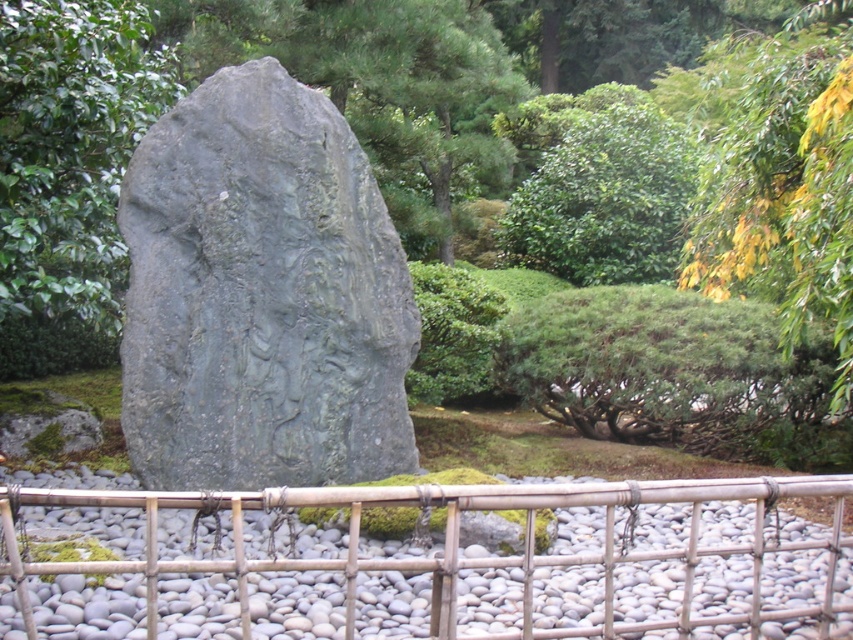
Is gray stone carving at center closer to the viewer compared to green leafy bush at upper center?

Yes, it is.

Is the position of gray stone carving at center more distant than that of green leafy bush at upper center?

That is False.

Is point (178, 410) in front of point (679, 170)?

Yes, point (178, 410) is closer to viewer.

Find the location of `gray stone carving at center`. gray stone carving at center is located at coordinates (260, 296).

Who is lower down, white pebbles at center or gray stone carving at center?

white pebbles at center

Which is above, white pebbles at center or gray stone carving at center?

Positioned higher is gray stone carving at center.

The width and height of the screenshot is (853, 640). Identify the location of white pebbles at center. (427, 563).

Image resolution: width=853 pixels, height=640 pixels. What do you see at coordinates (427, 563) in the screenshot?
I see `white pebbles at center` at bounding box center [427, 563].

Which is in front, point (234, 500) or point (54, 184)?

Point (234, 500)

Identify the location of white pebbles at center. (427, 563).